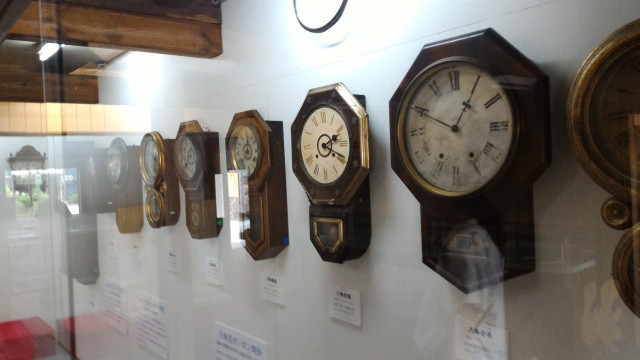
Locate an element on the screen. This screenshot has height=360, width=640. ceiling light is located at coordinates (50, 51).